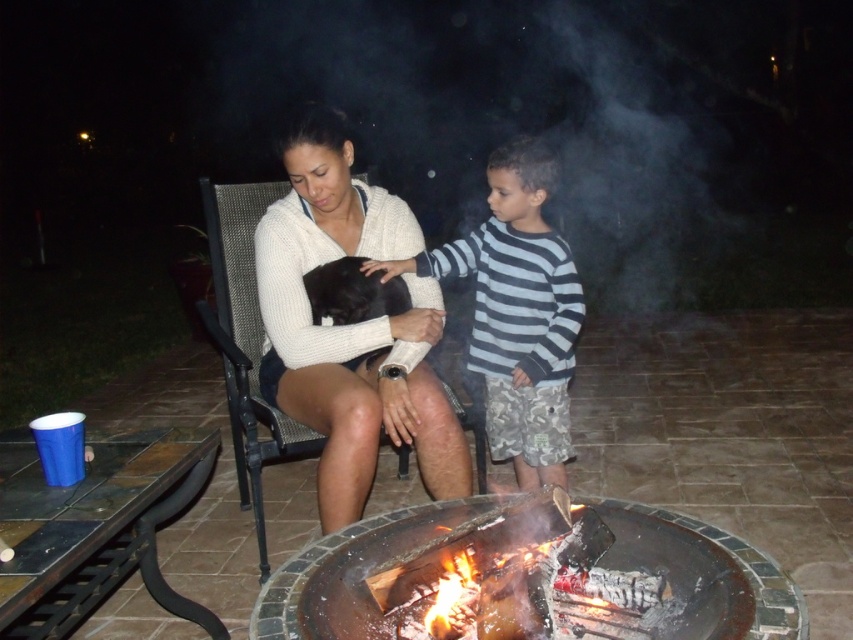
Question: Does white knit sweater at center come behind striped cotton shirt at center?

Choices:
 (A) no
 (B) yes

Answer: (A)

Question: Which object is positioned farthest from the striped cotton shirt at center?

Choices:
 (A) white knit sweater at center
 (B) charcoal gray stone fire pit at center

Answer: (B)

Question: Which object appears closest to the camera in this image?

Choices:
 (A) white knit sweater at center
 (B) striped cotton shirt at center

Answer: (A)

Question: Does white knit sweater at center appear over striped cotton shirt at center?

Choices:
 (A) no
 (B) yes

Answer: (B)

Question: Which object is farther from the camera taking this photo?

Choices:
 (A) white knit sweater at center
 (B) charcoal gray stone fire pit at center
 (C) striped cotton shirt at center

Answer: (C)

Question: Can you confirm if white knit sweater at center is positioned to the right of striped cotton shirt at center?

Choices:
 (A) yes
 (B) no

Answer: (B)